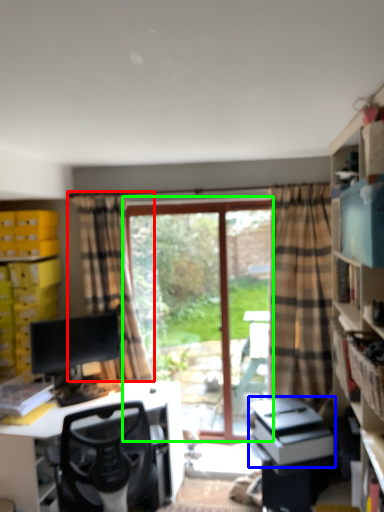
Question: Based on their relative distances, which object is nearer to curtain (highlighted by a red box)? Choose from printer (highlighted by a blue box) and window (highlighted by a green box).

Choices:
 (A) printer
 (B) window

Answer: (B)